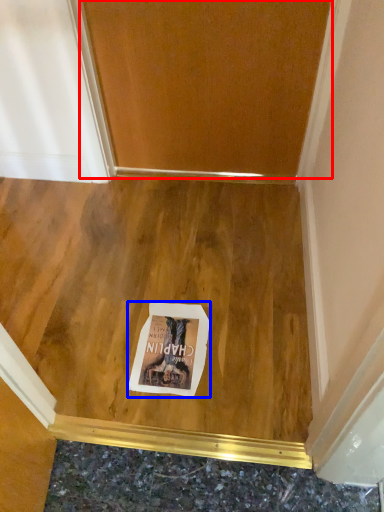
Question: Which of the following is the farthest to the observer, door (highlighted by a red box) or postcard (highlighted by a blue box)?

Choices:
 (A) door
 (B) postcard

Answer: (A)